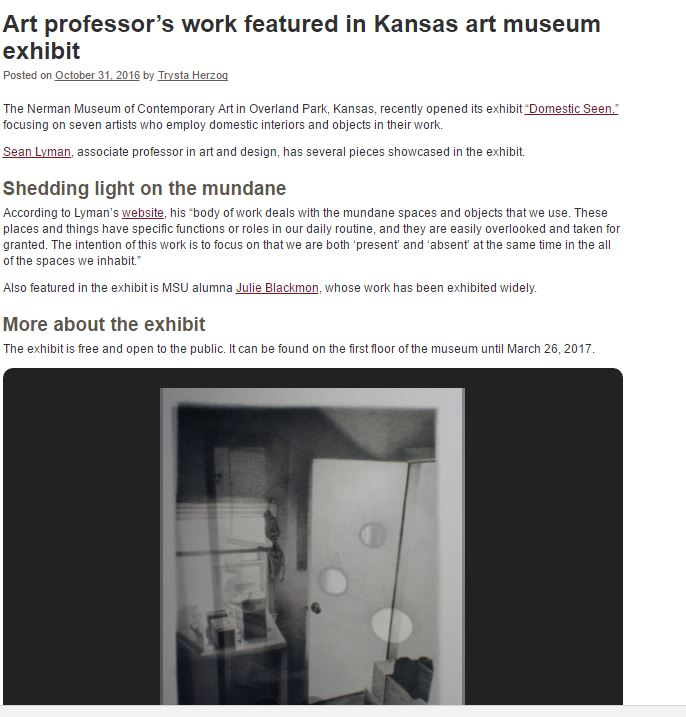
Where is `blinds`? blinds is located at coordinates (219, 485).